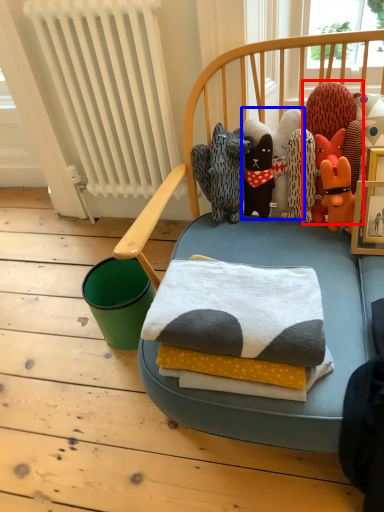
Question: Among these objects, which one is nearest to the camera, toy (highlighted by a red box) or toy (highlighted by a blue box)?

Choices:
 (A) toy
 (B) toy

Answer: (A)